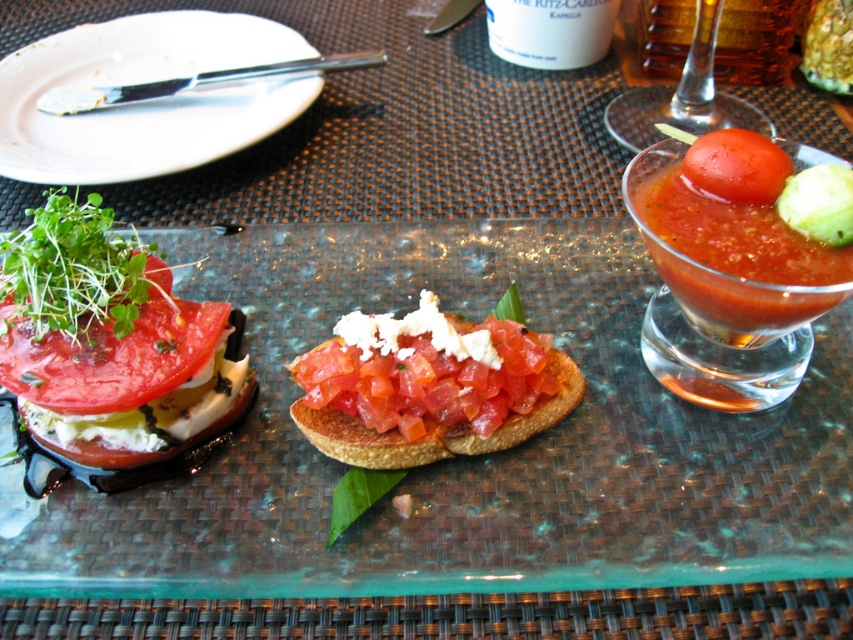
Does amber glass wine at upper right have a greater height compared to red matte tomato at upper right?

Indeed, amber glass wine at upper right has a greater height compared to red matte tomato at upper right.

Image resolution: width=853 pixels, height=640 pixels. What are the coordinates of `amber glass wine at upper right` in the screenshot? It's located at (753, 40).

Is matte brown bread at center wider than red matte tomato at left?

Yes.

Is point (131, 525) behind point (172, 321)?

No, it is not.

The height and width of the screenshot is (640, 853). Identify the location of matte brown bread at center. (462, 458).

I want to click on matte brown bread at center, so click(462, 458).

Does matte brown bread at center appear on the left side of translucent glass cup at upper center?

Indeed, matte brown bread at center is positioned on the left side of translucent glass cup at upper center.

Does matte brown bread at center have a lesser width compared to translucent glass cup at upper center?

No.

Find the location of a particular element. This screenshot has width=853, height=640. matte brown bread at center is located at coordinates (462, 458).

This screenshot has width=853, height=640. What are the coordinates of `matte brown bread at center` in the screenshot? It's located at (462, 458).